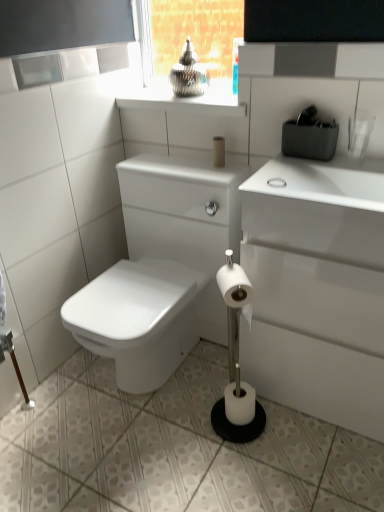
Question: Should I look upward or downward to see matte beige toilet paper at center, which ranks as the third toilet paper in front-to-back order?

Choices:
 (A) down
 (B) up

Answer: (B)

Question: Does white glossy toilet at lower left have a greater width compared to white glossy ceramic tile at lower center?

Choices:
 (A) no
 (B) yes

Answer: (A)

Question: Can we say white glossy toilet at lower left lies outside white glossy ceramic tile at lower center?

Choices:
 (A) yes
 (B) no

Answer: (A)

Question: Is white glossy toilet at lower left aimed at white glossy ceramic tile at lower center?

Choices:
 (A) yes
 (B) no

Answer: (B)

Question: Does white glossy toilet at lower left lie in front of white glossy ceramic tile at lower center?

Choices:
 (A) no
 (B) yes

Answer: (A)

Question: Is white glossy toilet at lower left surrounding white glossy ceramic tile at lower center?

Choices:
 (A) no
 (B) yes

Answer: (A)

Question: Does white glossy toilet at lower left have a greater height compared to white glossy ceramic tile at lower center?

Choices:
 (A) no
 (B) yes

Answer: (B)

Question: Is matte beige toilet paper at center, which ranks as the third toilet paper in front-to-back order, surrounded by white matte toilet paper at center, which is the second toilet paper in front-to-back order?

Choices:
 (A) no
 (B) yes

Answer: (A)

Question: Can you confirm if white matte toilet paper at center, the 2th toilet paper viewed from the back, is positioned to the right of matte beige toilet paper at center, positioned as the first toilet paper in top-to-bottom order?

Choices:
 (A) no
 (B) yes

Answer: (B)

Question: Could you tell me if white matte toilet paper at center, the 1th toilet paper when ordered from bottom to top, is turned towards matte beige toilet paper at center, which ranks as the third toilet paper in front-to-back order?

Choices:
 (A) yes
 (B) no

Answer: (B)

Question: Can you confirm if white matte toilet paper at center, the 2th toilet paper viewed from the back, is positioned to the left of matte beige toilet paper at center, positioned as the first toilet paper in top-to-bottom order?

Choices:
 (A) no
 (B) yes

Answer: (A)

Question: From the image's perspective, does white matte toilet paper at center, which is the second toilet paper in front-to-back order, appear lower than matte beige toilet paper at center, positioned as the first toilet paper in top-to-bottom order?

Choices:
 (A) no
 (B) yes

Answer: (B)

Question: Can you confirm if white matte toilet paper at center, acting as the 3th toilet paper starting from the top, is wider than matte beige toilet paper at center, the third toilet paper in the bottom-to-top sequence?

Choices:
 (A) yes
 (B) no

Answer: (A)

Question: Is white matte toilet paper at center, the 2th toilet paper viewed from the back, to the left of white matte toilet paper at center, positioned as the 2th toilet paper in top-to-bottom order, from the viewer's perspective?

Choices:
 (A) no
 (B) yes

Answer: (A)